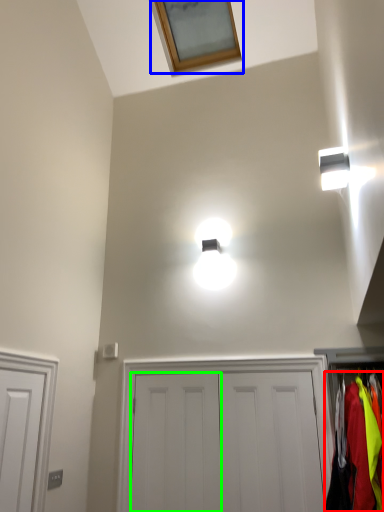
Question: Considering the real-world distances, which object is farthest from clothing (highlighted by a red box)? window (highlighted by a blue box) or door (highlighted by a green box)?

Choices:
 (A) window
 (B) door

Answer: (A)